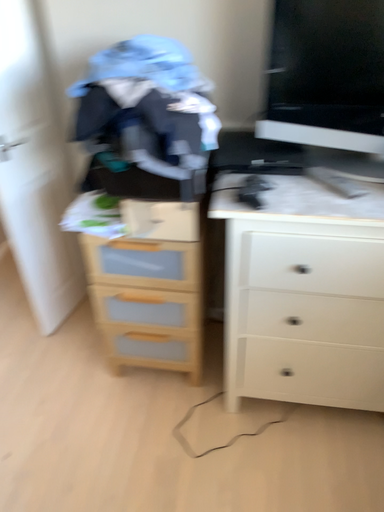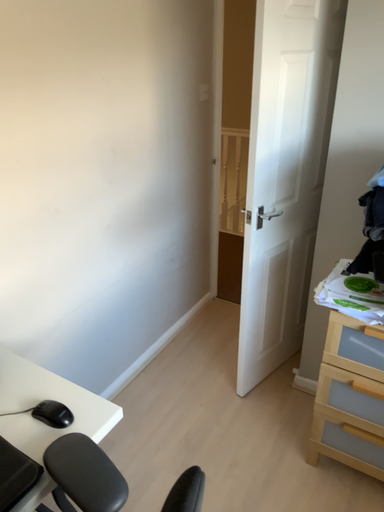
Question: Which way did the camera rotate in the video?

Choices:
 (A) rotated right
 (B) rotated left

Answer: (B)